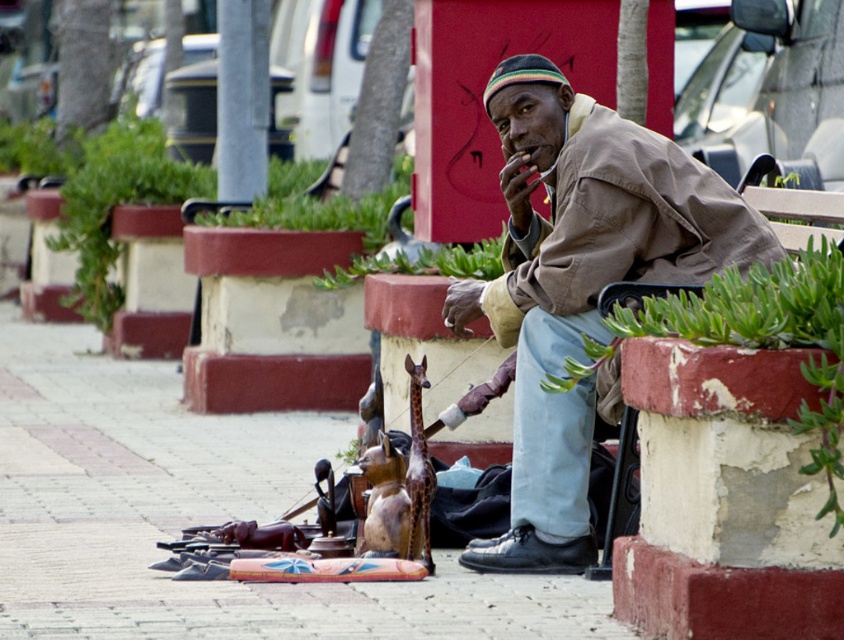
Who is more forward, (65, 516) or (542, 556)?

Point (542, 556) is in front.

Can you confirm if wooden figurines at lower center is bigger than black leather shoe at lower center?

Correct, wooden figurines at lower center is larger in size than black leather shoe at lower center.

The image size is (844, 640). Find the location of `wooden figurines at lower center`. wooden figurines at lower center is located at coordinates (199, 515).

Can you confirm if brown cotton jacket at center is positioned to the left of black leather shoe at lower center?

No, brown cotton jacket at center is not to the left of black leather shoe at lower center.

Can you confirm if brown cotton jacket at center is shorter than black leather shoe at lower center?

No, brown cotton jacket at center is not shorter than black leather shoe at lower center.

Is point (709, 244) positioned after point (521, 552)?

No, it is in front of (521, 552).

Where is `brown cotton jacket at center`? brown cotton jacket at center is located at coordinates (585, 264).

Does wooden figurines at lower center have a smaller size compared to brown cotton jacket at center?

No, wooden figurines at lower center is not smaller than brown cotton jacket at center.

Does wooden figurines at lower center appear over brown cotton jacket at center?

Actually, wooden figurines at lower center is below brown cotton jacket at center.

Is point (36, 387) more distant than point (540, 99)?

Yes, point (36, 387) is farther from viewer.

Locate an element on the screen. The height and width of the screenshot is (640, 844). wooden figurines at lower center is located at coordinates (199, 515).